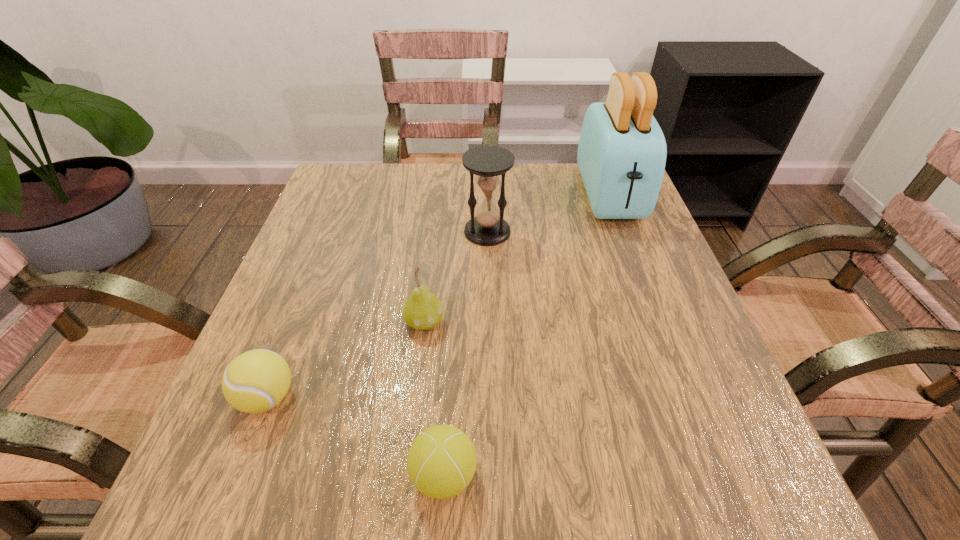
Image resolution: width=960 pixels, height=540 pixels. I want to click on free spot that satisfies the following two spatial constraints: 1. on the front side of the right tennis ball; 2. on the left side of the leftmost object, so tap(237, 475).